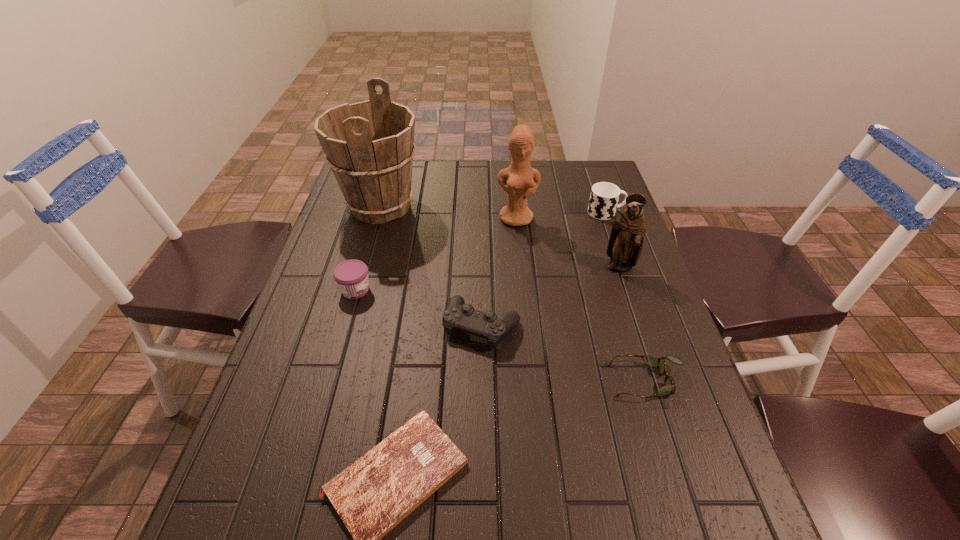
This screenshot has width=960, height=540. I want to click on jam located in the left edge section of the desktop, so click(351, 276).

I want to click on figurine located in the right edge section of the desktop, so click(625, 244).

Find the location of `cup that is at the right edge`. cup that is at the right edge is located at coordinates (604, 197).

This screenshot has height=540, width=960. I want to click on spectacles situated at the right edge, so pyautogui.click(x=669, y=387).

Where is `object that is at the far left corner`? The image size is (960, 540). object that is at the far left corner is located at coordinates (369, 145).

I want to click on vacant space at the far edge, so click(417, 160).

In the image, there is a desktop. Identify the location of vacant space at the near edge. (599, 535).

You are a GUI agent. You are given a task and a screenshot of the screen. Output one action in this format:
    pyautogui.click(x=<x>, y=<y>)
    Task: Click on the vacant space at the left edge of the desktop
    The image size is (960, 540).
    Given the screenshot: What is the action you would take?
    pyautogui.click(x=371, y=277)

Locate an element on the screen. Image resolution: width=960 pixels, height=540 pixels. vacant space at the right edge of the desktop is located at coordinates (634, 301).

In order to click on vacant space that is in between the nearer figurine and the control in this screenshot , I will do `click(550, 297)`.